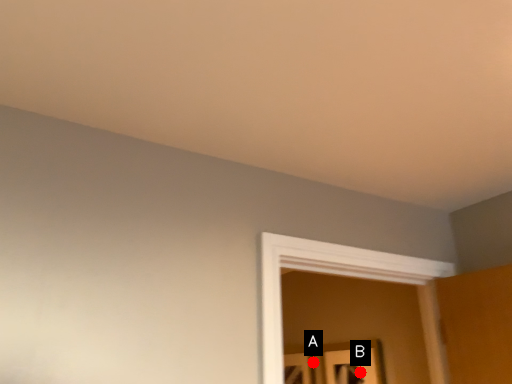
Question: Two points are circled on the image, labeled by A and B beside each circle. Which point is farther from the camera taking this photo?

Choices:
 (A) A is further
 (B) B is further

Answer: (A)